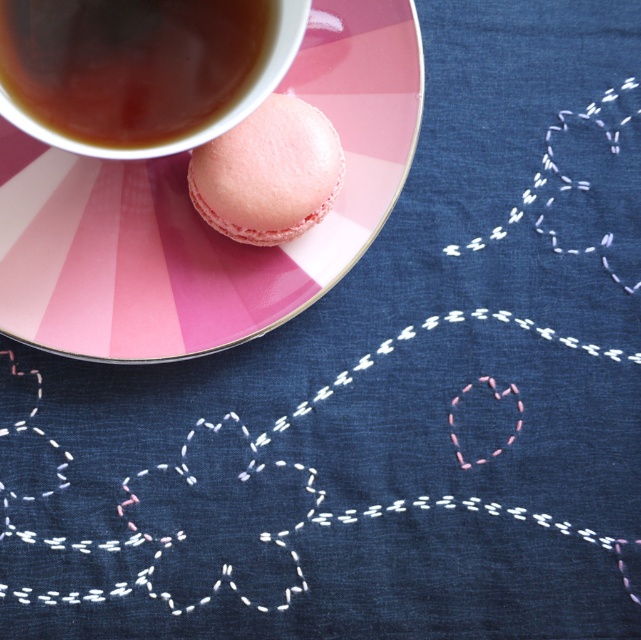
Question: Which point is closer to the camera taking this photo?

Choices:
 (A) (112, 230)
 (B) (8, 40)
 (C) (238, 170)

Answer: (B)

Question: Which point appears farthest from the camera in this image?

Choices:
 (A) (137, 72)
 (B) (146, 292)

Answer: (B)

Question: Which object is positioned farthest from the dark brown liquid at upper left?

Choices:
 (A) pink glossy macaron at upper left
 (B) pink matte macaron at center

Answer: (A)

Question: Is dark brown liquid at upper left wider than pink matte macaron at center?

Choices:
 (A) yes
 (B) no

Answer: (A)

Question: Considering the relative positions of pink glossy macaron at upper left and pink matte macaron at center in the image provided, where is pink glossy macaron at upper left located with respect to pink matte macaron at center?

Choices:
 (A) above
 (B) below

Answer: (A)

Question: Is pink glossy macaron at upper left bigger than pink matte macaron at center?

Choices:
 (A) yes
 (B) no

Answer: (A)